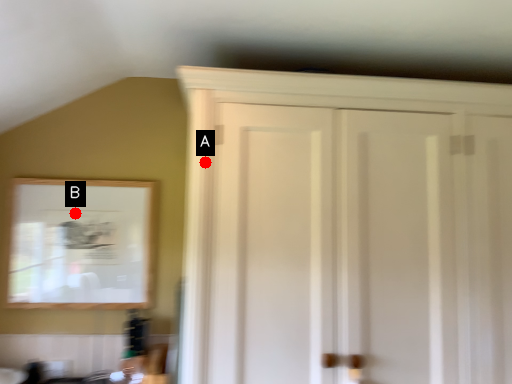
Question: Two points are circled on the image, labeled by A and B beside each circle. Which point appears closest to the camera in this image?

Choices:
 (A) A is closer
 (B) B is closer

Answer: (A)